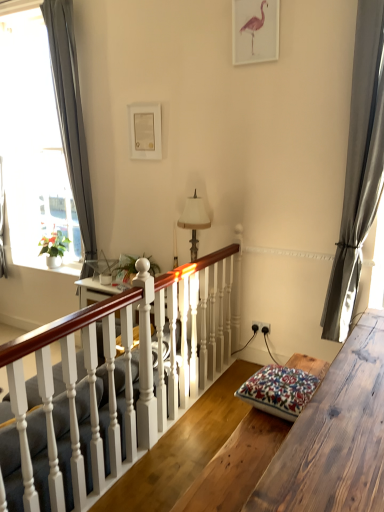
Where is `free point above wooden table at lower right (from a real-world perspective)`? free point above wooden table at lower right (from a real-world perspective) is located at coordinates click(346, 407).